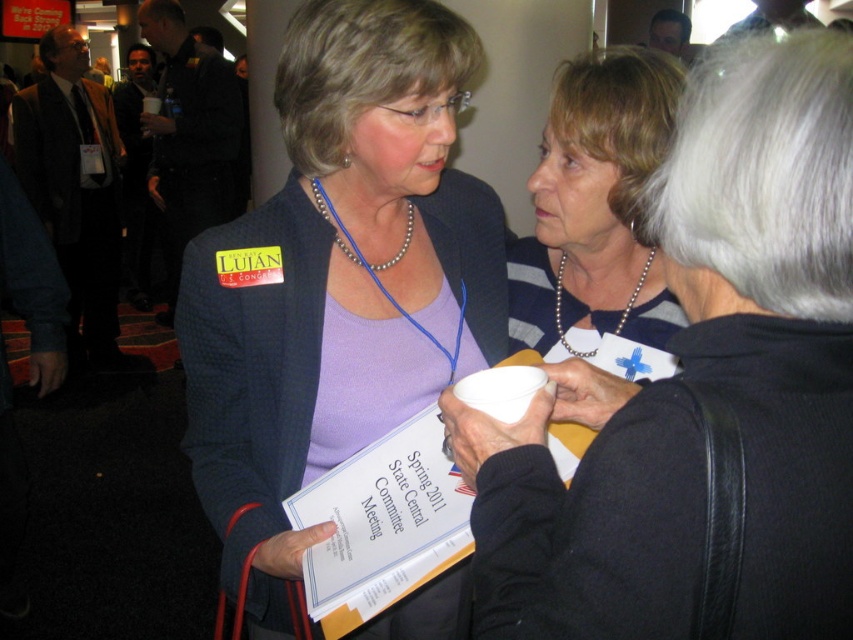
You are organizing a conference and need to place a name tag holder at position point 0.5, 0.4. The attendee with the matte black blazer at center is standing at point 0.441, 0.396. Will the name tag holder be placed in front of or behind the attendee?

The name tag holder at position (340, 320) is behind the matte black blazer at center because the attendee is located at point (337, 282), which is closer to the front.

You are at a conference and need to place the matte white cup at center on top of the matte black blazer at center. Considering their sizes, will the cup fit without falling over?

The matte white cup at center has a lesser height compared to the matte black blazer at center, so it will likely fit without falling over as long as the surface area is sufficient.

You are at a conference and need to grab a drink. You see a matte white cup at center and a pearl necklace at center. Which item is located lower?

The matte white cup at center is located lower than the pearl necklace at center.